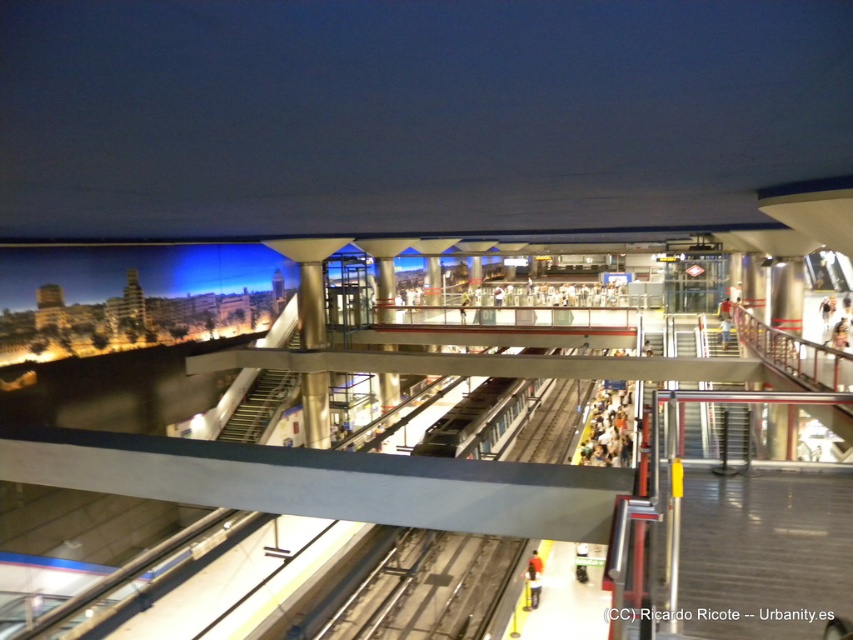
You are standing on the platform at the modern urban transit station. You see a matte black crowd at lower center and a matte black jacket at lower center. Which object is positioned to the left of the other?

The matte black jacket at lower center is positioned to the left of the matte black crowd at lower center.